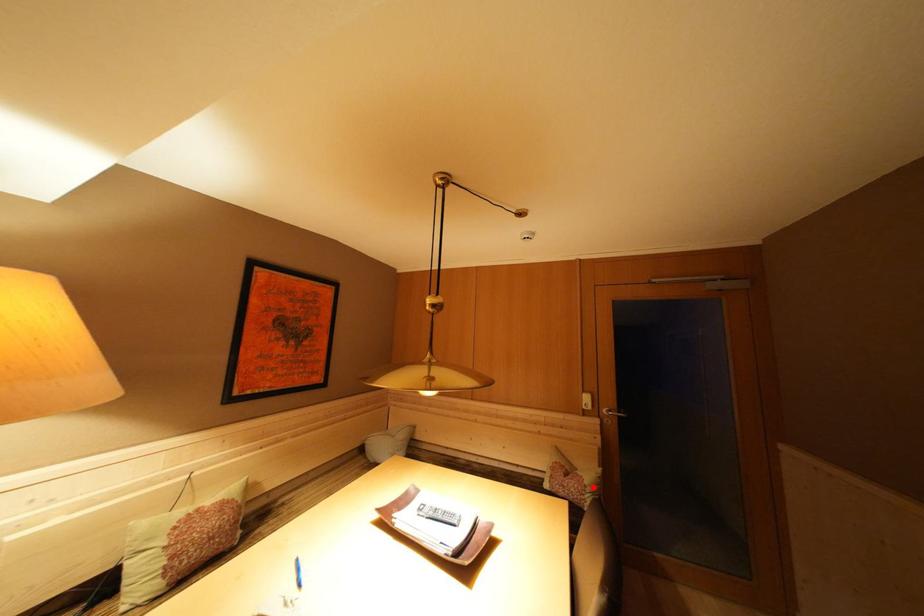
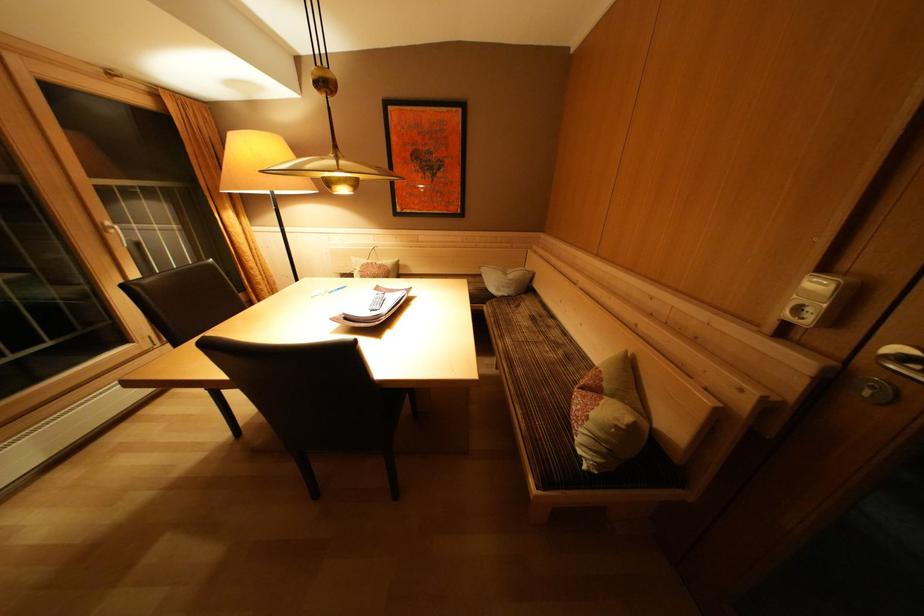
Locate, in the second image, the point that corresponds to the highlighted location in the first image.

(600, 419)